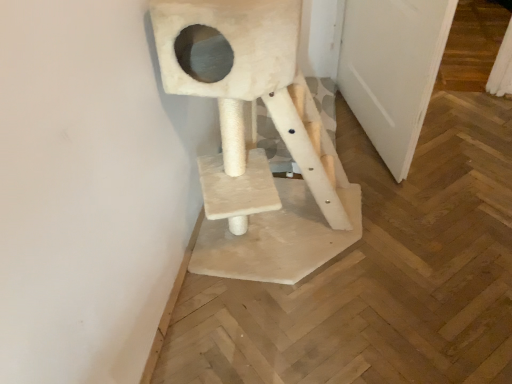
Question: Is white matte door at right thinner than sanded wood cat tree at center?

Choices:
 (A) no
 (B) yes

Answer: (B)

Question: From the image's perspective, is white matte door at right on sanded wood cat tree at center?

Choices:
 (A) no
 (B) yes

Answer: (B)

Question: Is white matte door at right to the left of sanded wood cat tree at center from the viewer's perspective?

Choices:
 (A) no
 (B) yes

Answer: (A)

Question: Is the position of white matte door at right more distant than that of sanded wood cat tree at center?

Choices:
 (A) yes
 (B) no

Answer: (A)

Question: Is white matte door at right placed right next to sanded wood cat tree at center?

Choices:
 (A) yes
 (B) no

Answer: (B)

Question: Considering the relative sizes of white matte door at right and sanded wood cat tree at center in the image provided, is white matte door at right shorter than sanded wood cat tree at center?

Choices:
 (A) yes
 (B) no

Answer: (A)

Question: Does sanded wood cat tree at center have a smaller size compared to white matte door at right?

Choices:
 (A) no
 (B) yes

Answer: (A)

Question: Can you confirm if sanded wood cat tree at center is thinner than white matte door at right?

Choices:
 (A) no
 (B) yes

Answer: (A)

Question: Is sanded wood cat tree at center taller than white matte door at right?

Choices:
 (A) yes
 (B) no

Answer: (A)

Question: From the image's perspective, would you say sanded wood cat tree at center is shown under white matte door at right?

Choices:
 (A) no
 (B) yes

Answer: (B)

Question: Is sanded wood cat tree at center not within white matte door at right?

Choices:
 (A) yes
 (B) no

Answer: (A)

Question: Does sanded wood cat tree at center turn towards white matte door at right?

Choices:
 (A) no
 (B) yes

Answer: (A)

Question: From the image's perspective, is sanded wood cat tree at center located above or below white matte door at right?

Choices:
 (A) below
 (B) above

Answer: (A)